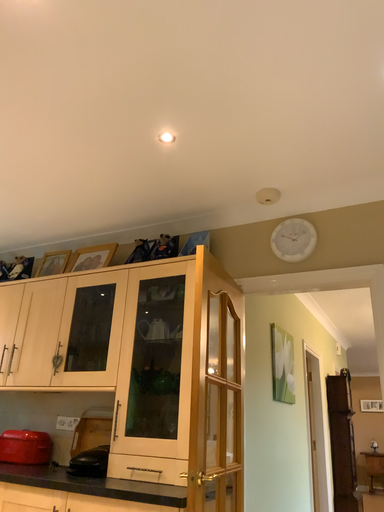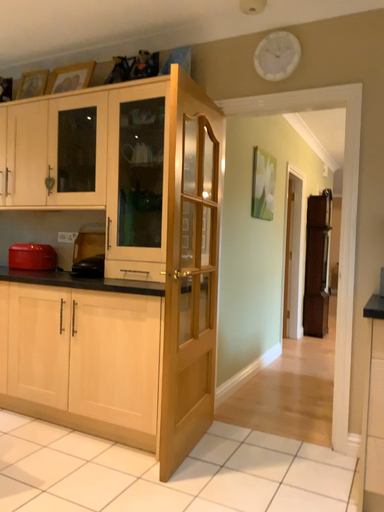
Question: Which way did the camera rotate in the video?

Choices:
 (A) rotated upward
 (B) rotated downward

Answer: (B)